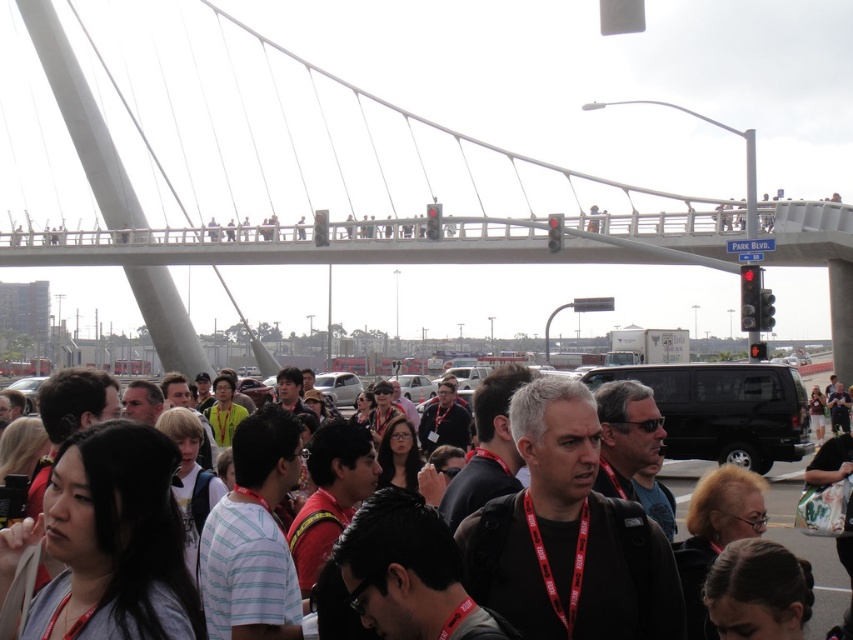
Does point (210, 106) come farther from viewer compared to point (834, 588)?

That is True.

Is white concrete pedestrian bridge at upper center wider than matte black backpack at center?

Yes, white concrete pedestrian bridge at upper center is wider than matte black backpack at center.

Between point (308, 227) and point (816, 573), which one is positioned behind?

Positioned behind is point (308, 227).

At what (x,y) coordinates should I click in order to perform the action: click on white concrete pedestrian bridge at upper center. Please return your answer as a coordinate pair (x, y). Looking at the image, I should click on (412, 156).